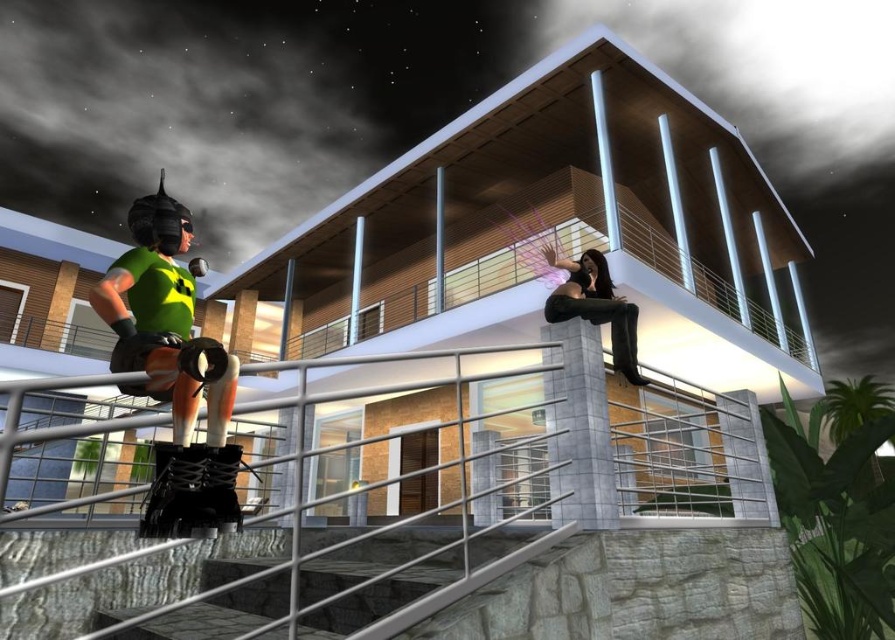
Does metallic silver rail at lower center come behind stone textured stairs at lower center?

Yes, metallic silver rail at lower center is further from the viewer.

Which of these two, metallic silver rail at lower center or stone textured stairs at lower center, stands taller?

metallic silver rail at lower center is taller.

Find the location of a particular element. The width and height of the screenshot is (895, 640). metallic silver rail at lower center is located at coordinates (637, 538).

The image size is (895, 640). I want to click on metallic silver rail at lower center, so click(637, 538).

Can you confirm if matte green jersey at left is shorter than matte black pants at upper center?

Incorrect, matte green jersey at left's height does not fall short of matte black pants at upper center's.

Does matte green jersey at left appear on the left side of matte black pants at upper center?

Correct, you'll find matte green jersey at left to the left of matte black pants at upper center.

Between point (150, 278) and point (561, 259), which one is positioned behind?

Positioned behind is point (561, 259).

Where is `matte green jersey at left`? The height and width of the screenshot is (640, 895). matte green jersey at left is located at coordinates (172, 369).

Is stone textured stairs at lower center below matte black pants at upper center?

Correct, stone textured stairs at lower center is located below matte black pants at upper center.

Between point (227, 628) and point (618, 298), which one is positioned behind?

The point (618, 298) is more distant.

Identify the location of stone textured stairs at lower center. This screenshot has width=895, height=640. (331, 592).

This screenshot has height=640, width=895. Find the location of `stone textured stairs at lower center`. stone textured stairs at lower center is located at coordinates (331, 592).